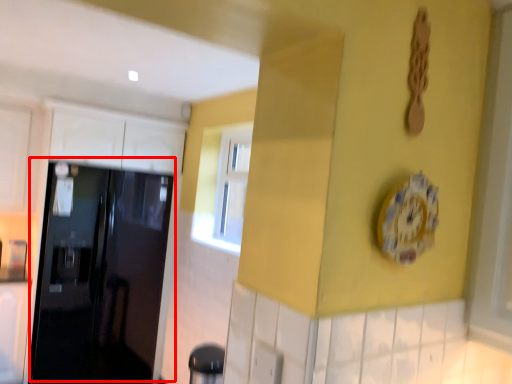
Question: In this image, where is door (annotated by the red box) located relative to clock?

Choices:
 (A) left
 (B) right

Answer: (A)